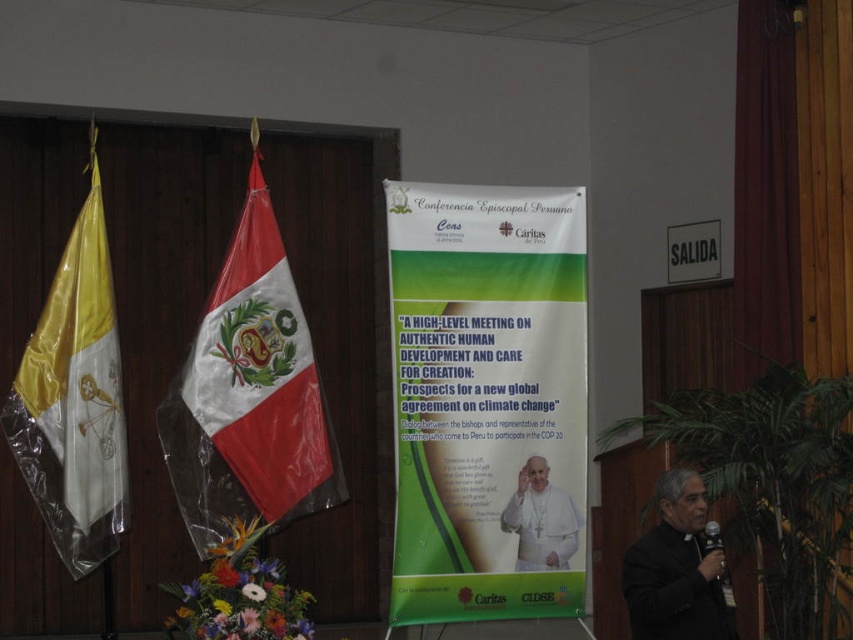
Is point (276, 291) positioned in front of point (547, 480)?

Yes, it is.

Is shiny plastic flag at left wider than white cloth at center?

Yes, shiny plastic flag at left is wider than white cloth at center.

Who is more distant from viewer, [218,346] or [531,486]?

The point [531,486] is behind.

Locate an element on the screen. The image size is (853, 640). shiny plastic flag at left is located at coordinates (248, 394).

What do you see at coordinates (248, 394) in the screenshot? The width and height of the screenshot is (853, 640). I see `shiny plastic flag at left` at bounding box center [248, 394].

This screenshot has width=853, height=640. I want to click on shiny plastic flag at left, so click(248, 394).

Which is in front, point (416, 435) or point (64, 560)?

Point (416, 435) is more forward.

Is green matte poster at center behind yellow satin flag at left?

No, it is in front of yellow satin flag at left.

Locate an element on the screen. Image resolution: width=853 pixels, height=640 pixels. green matte poster at center is located at coordinates (486, 401).